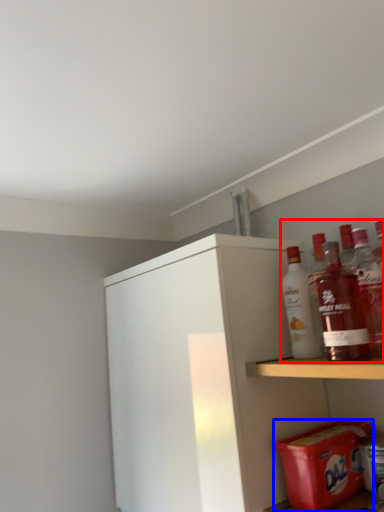
Question: Which point is closer to the camera, beverage (highlighted by a red box) or carton (highlighted by a blue box)?

Choices:
 (A) beverage
 (B) carton

Answer: (A)